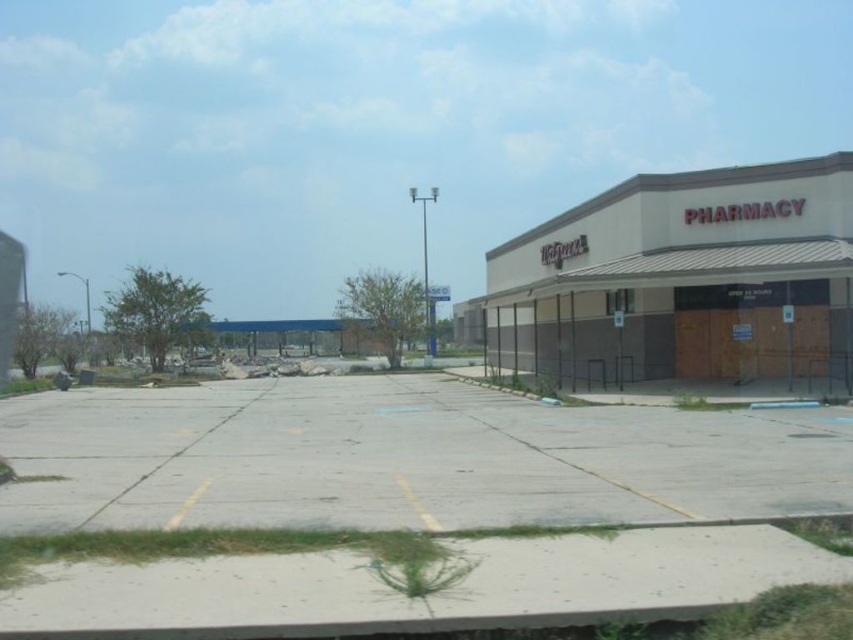
Question: Does gray concrete parking lot at center appear on the left side of brown matte building at right?

Choices:
 (A) no
 (B) yes

Answer: (B)

Question: Is gray concrete parking lot at center positioned at the back of brown matte building at right?

Choices:
 (A) yes
 (B) no

Answer: (B)

Question: Is gray concrete parking lot at center positioned before brown matte building at right?

Choices:
 (A) yes
 (B) no

Answer: (A)

Question: Which point is farther from the camera taking this photo?

Choices:
 (A) (756, 486)
 (B) (712, 184)

Answer: (B)